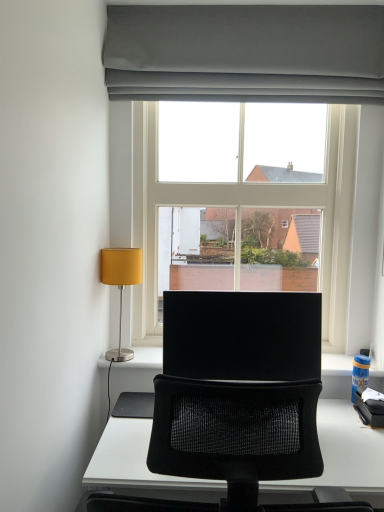
Question: Relative to matte yellow fabric lampshade at left, is clear glass window at center in front or behind?

Choices:
 (A) behind
 (B) front

Answer: (A)

Question: Considering the relative positions of clear glass window at center and matte yellow fabric lampshade at left in the image provided, is clear glass window at center to the left or to the right of matte yellow fabric lampshade at left?

Choices:
 (A) left
 (B) right

Answer: (B)

Question: Which is farther from the matte gray curtain at upper center?

Choices:
 (A) clear glass window at center
 (B) black matte computer monitor at center
 (C) matte yellow fabric lampshade at left

Answer: (B)

Question: Which object is positioned farthest from the clear glass window at center?

Choices:
 (A) matte yellow fabric lampshade at left
 (B) black matte computer monitor at center
 (C) matte gray curtain at upper center

Answer: (A)